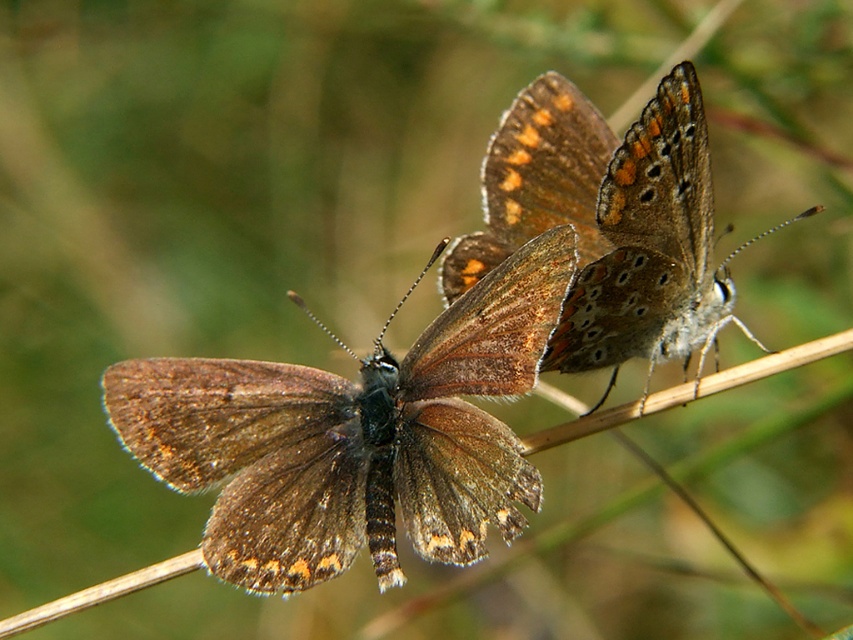
You are an entomologist observing three butterflies on a twig. You notice the brown fuzzy butterfly at center and the brown textured wings at center. Which of these two has a larger size?

The brown textured wings at center is larger than the brown fuzzy butterfly at center according to the description.

You are an entomologist observing the butterflies. Which object is closer to you between the brown fuzzy butterfly at center and the brown textured wings at center?

The brown fuzzy butterfly at center is closer to you than the brown textured wings at center.